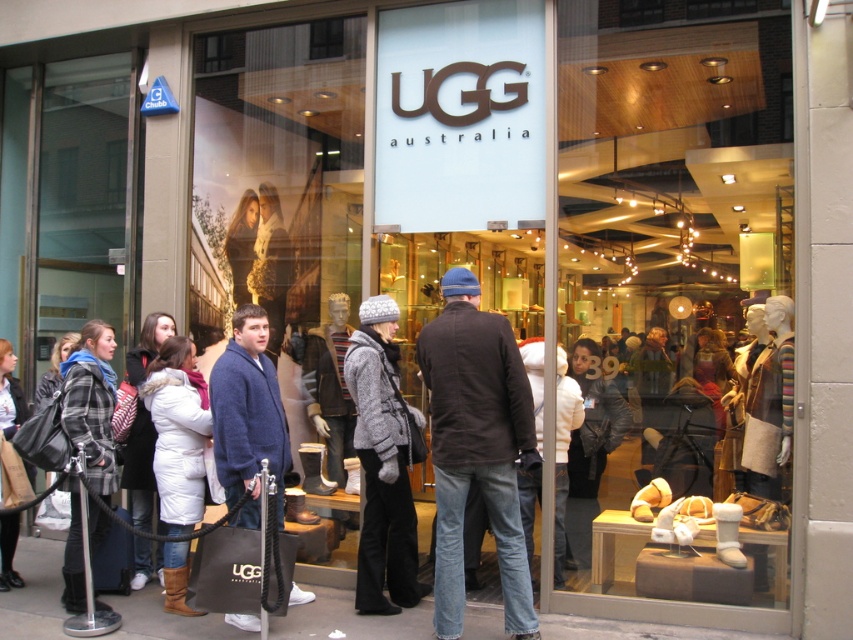
You are standing outside the UGG Australia store and want to see both the white suede boots at center and the white fur coat at center through the storefront window. Which one appears closer to you when looking through the window?

The white suede boots at center appears closer to you because it is positioned closer to the viewer than the white fur coat at center.

Consider the image. You are a customer looking at the UGG Australia store window. You see the matte black boots at center and the white down jacket at center. Which item is placed higher in the display?

The matte black boots at center is positioned over the white down jacket at center, so it is placed higher in the display.

In the scene shown: You are a delivery person who needs to place a package between the matte black boots at center and the dark brown leather jacket at center. The package requires 10 feet of space. Is there enough space between them?

The distance between the matte black boots at center and the dark brown leather jacket at center is 9.31 feet, which is less than the required 10 feet. Therefore, there is not enough space to place the package between them.